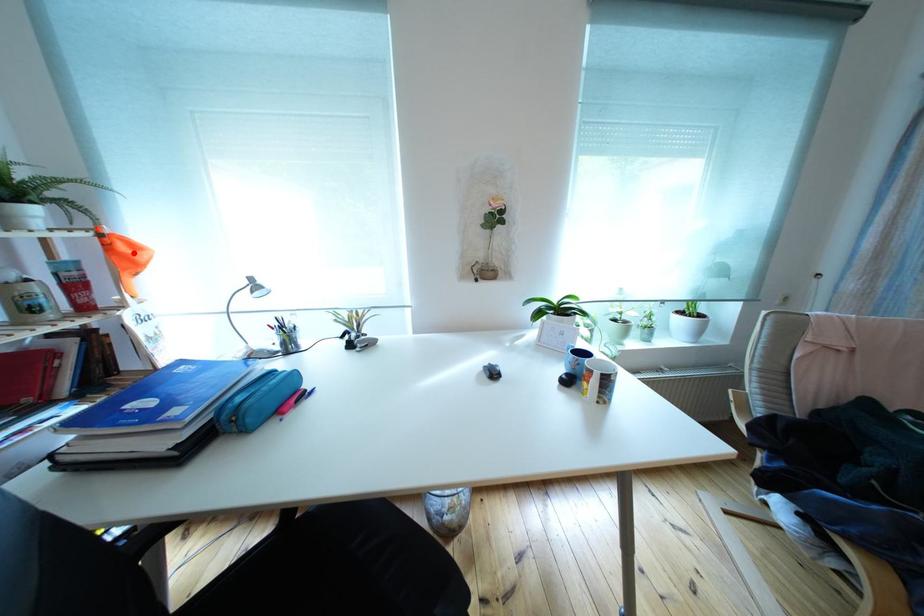
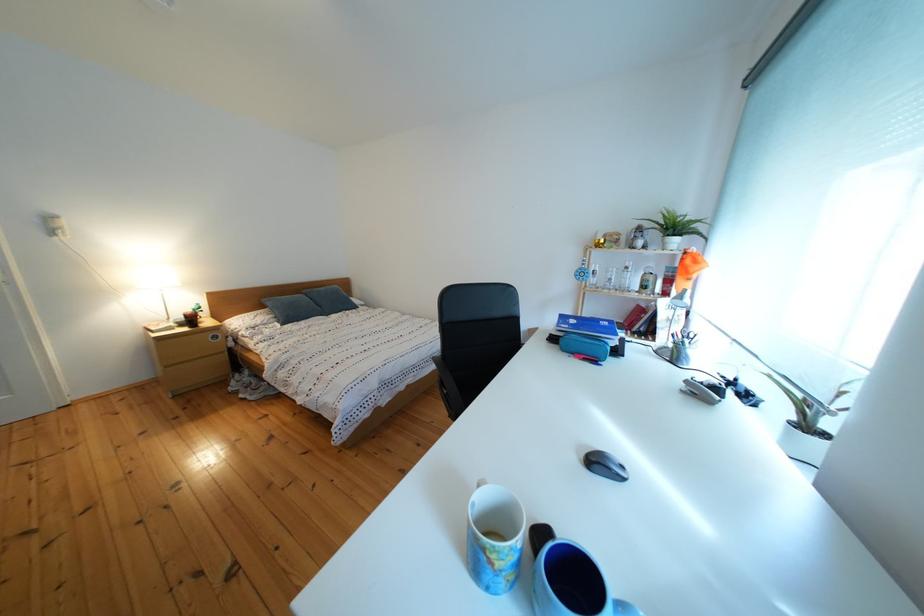
Locate, in the second image, the point that corresponds to the highlighted location in the first image.

(699, 267)